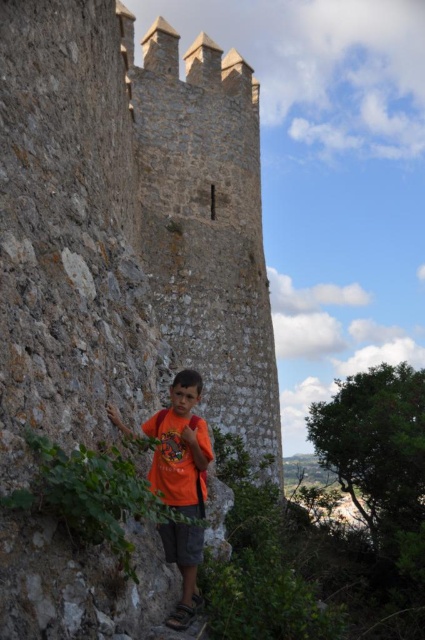
Question: Which of the following is the farthest from the observer?

Choices:
 (A) rustic stone tower at center
 (B) orange cotton shirt at center

Answer: (B)

Question: Is the position of rustic stone tower at center more distant than that of orange cotton shirt at center?

Choices:
 (A) no
 (B) yes

Answer: (A)

Question: Can you confirm if rustic stone tower at center is bigger than orange cotton shirt at center?

Choices:
 (A) no
 (B) yes

Answer: (B)

Question: Which of the following is the farthest from the observer?

Choices:
 (A) (195, 132)
 (B) (198, 541)

Answer: (A)

Question: Can you confirm if rustic stone tower at center is positioned to the right of orange cotton shirt at center?

Choices:
 (A) yes
 (B) no

Answer: (A)